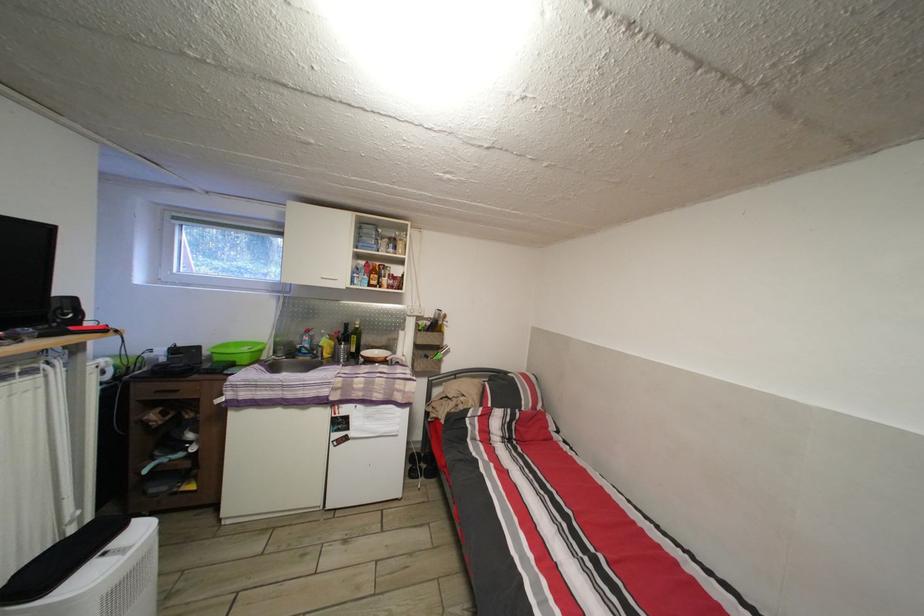
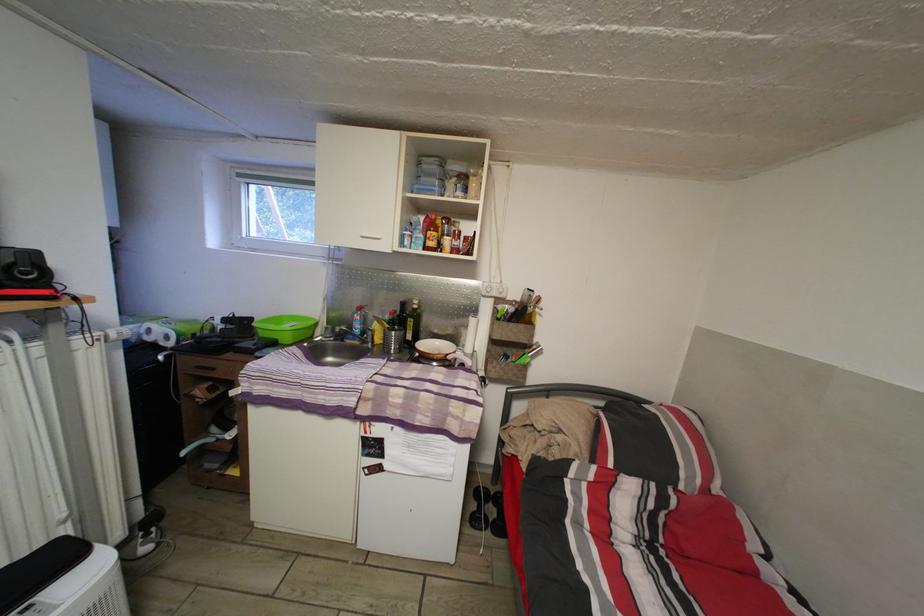
Find the pixel in the second image that matches [360,357] in the first image.

(417, 344)